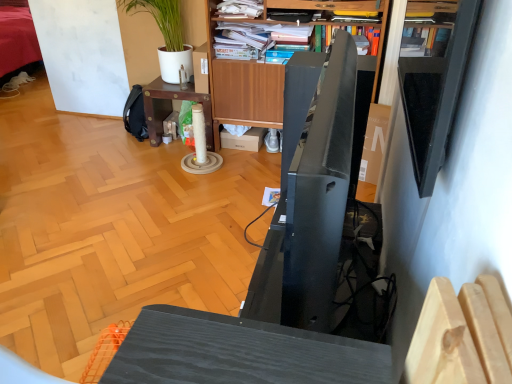
Find the location of a particular element. This screenshot has height=384, width=512. vacant area situated to the left side of wooden desk at center is located at coordinates (125, 151).